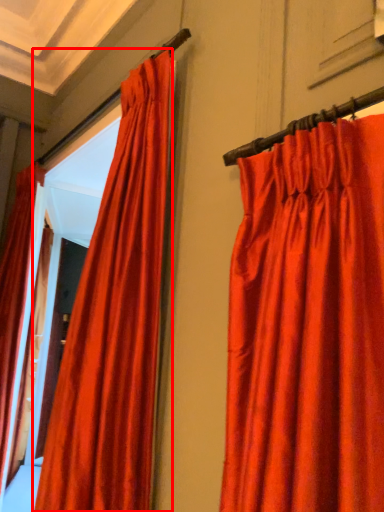
Question: Considering the relative positions of curtain (annotated by the red box) and curtain in the image provided, where is curtain (annotated by the red box) located with respect to the staircase?

Choices:
 (A) right
 (B) left

Answer: (A)